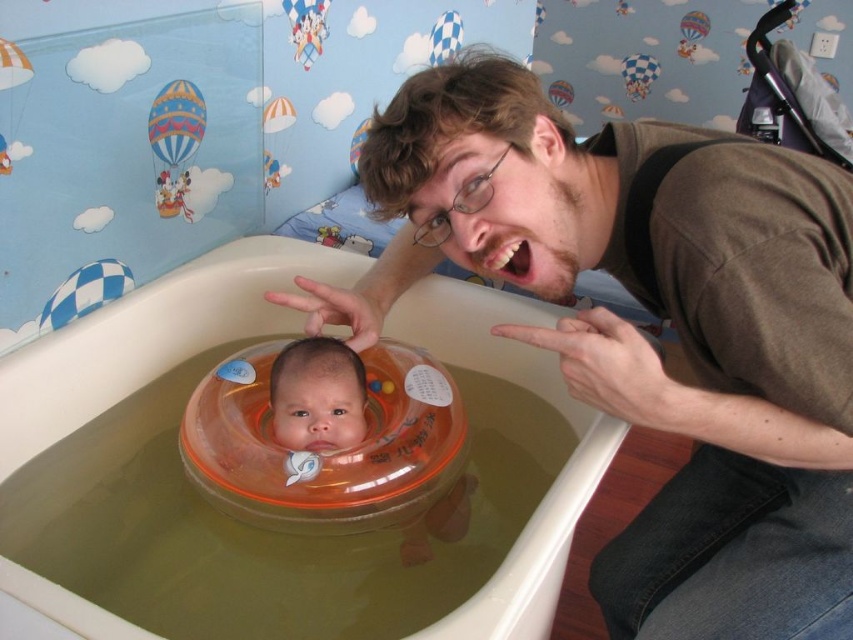
Between brown cotton shirt at upper right and multicolored fabric hot air balloon at upper left, which one is positioned higher?

Positioned higher is multicolored fabric hot air balloon at upper left.

Does brown cotton shirt at upper right have a greater height compared to multicolored fabric hot air balloon at upper left?

Correct, brown cotton shirt at upper right is much taller as multicolored fabric hot air balloon at upper left.

Is point (669, 600) in front of point (157, 124)?

Yes.

This screenshot has height=640, width=853. I want to click on brown cotton shirt at upper right, so click(637, 332).

Looking at this image, who is positioned more to the right, translucent orange float at center or multicolored fabric hot air balloon at upper left?

translucent orange float at center

Which of these two, translucent orange float at center or multicolored fabric hot air balloon at upper left, stands shorter?

multicolored fabric hot air balloon at upper left

Which is in front, point (503, 371) or point (189, 84)?

Positioned in front is point (189, 84).

You are a GUI agent. You are given a task and a screenshot of the screen. Output one action in this format:
    pyautogui.click(x=<x>, y=<y>)
    Task: Click on the translucent orange float at center
    The image size is (853, 640).
    Given the screenshot: What is the action you would take?
    pyautogui.click(x=152, y=337)

At what (x,y) coordinates should I click in order to perform the action: click on translucent orange float at center. Please return your answer as a coordinate pair (x, y). The width and height of the screenshot is (853, 640). Looking at the image, I should click on (152, 337).

Does translucent orange float at center appear on the left side of blue checkered float at upper left?

No, translucent orange float at center is not to the left of blue checkered float at upper left.

Where is `translucent orange float at center`? translucent orange float at center is located at coordinates click(x=152, y=337).